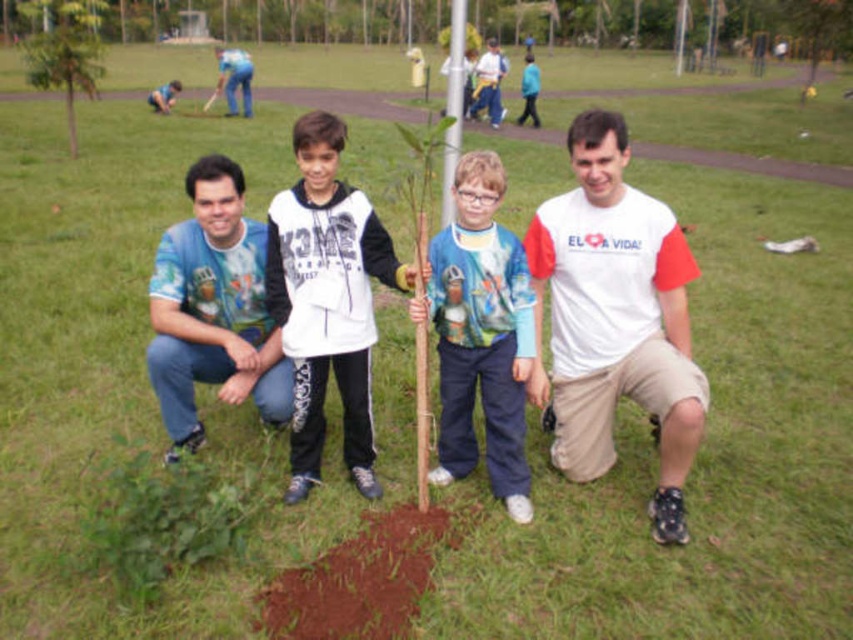
You are standing in the park and see the group around the newly planted tree. There is a point marked at coordinates (328, 300). Which object from the scene is located at this point?

The point at (328, 300) corresponds to the white matte shirt at center.